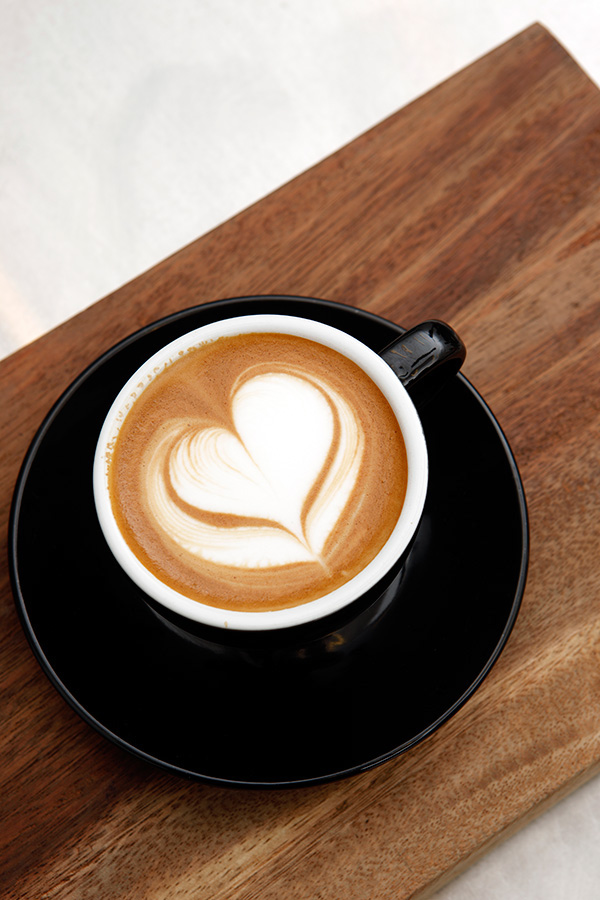
At what (x,y) coordinates should I click in order to perform the action: click on coffee mug handle. Please return your answer as a coordinate pair (x, y). Looking at the image, I should click on (444, 337).